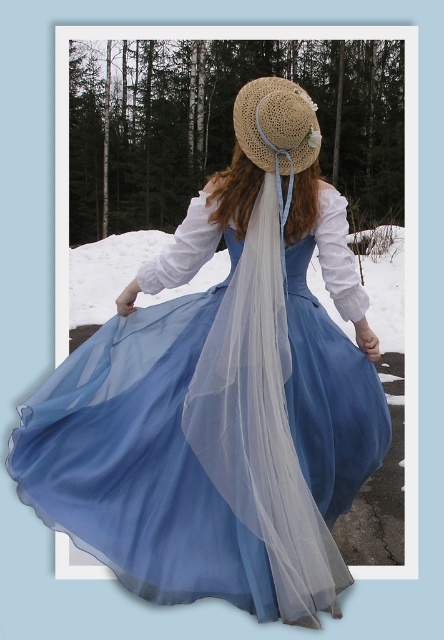
Does light blue chiffon dress at center have a smaller size compared to straw hat at center?

No.

Locate an element on the screen. light blue chiffon dress at center is located at coordinates (211, 438).